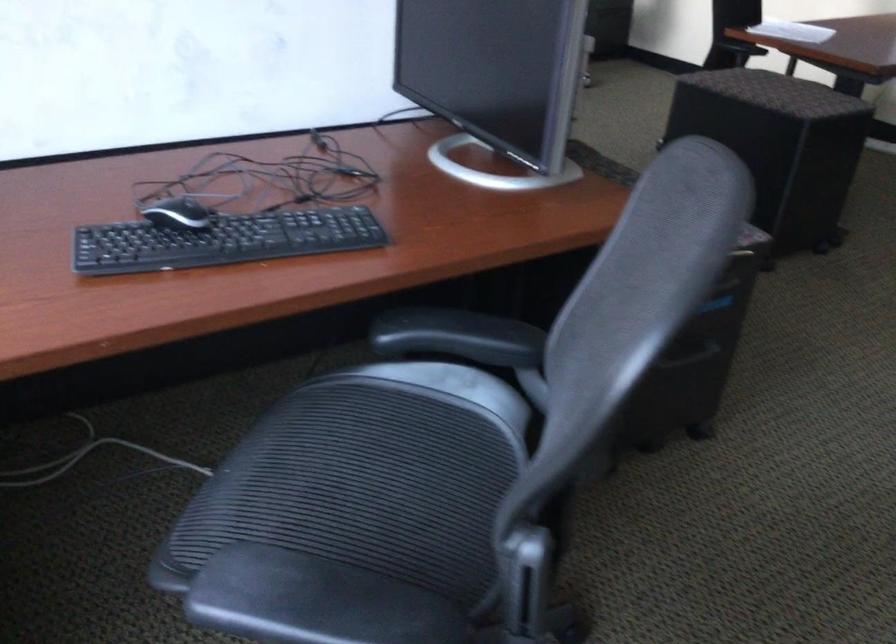
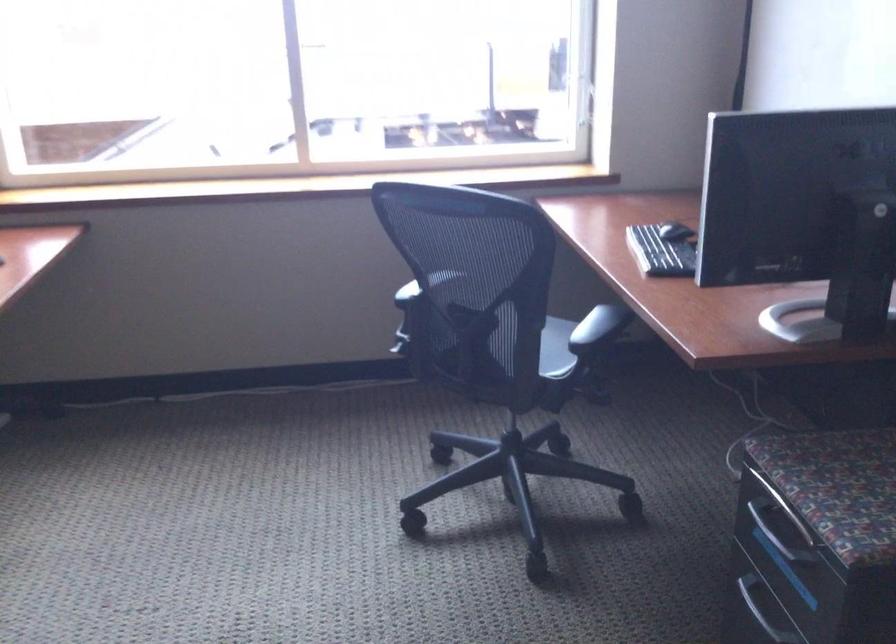
Locate, in the second image, the point that corresponds to (237,207) in the first image.

(676, 231)